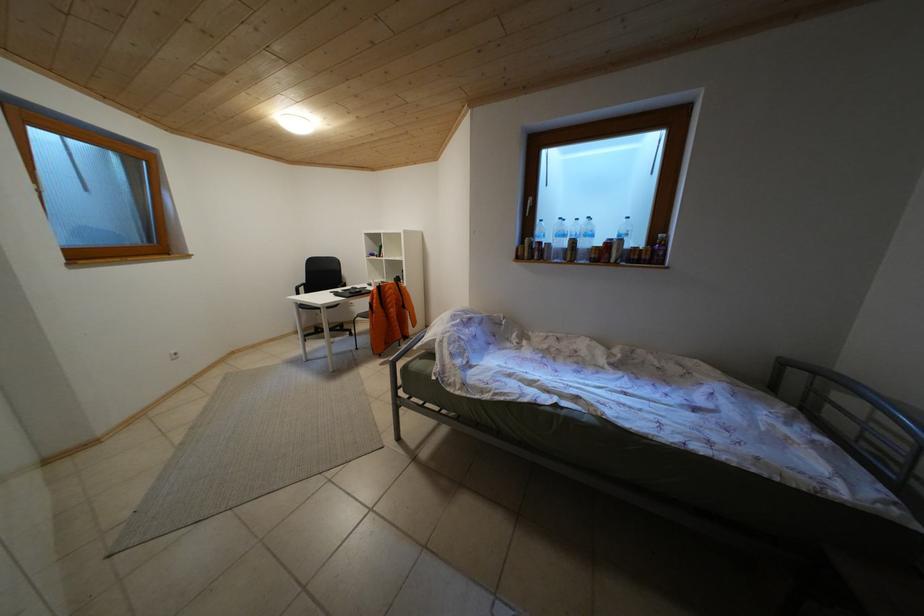
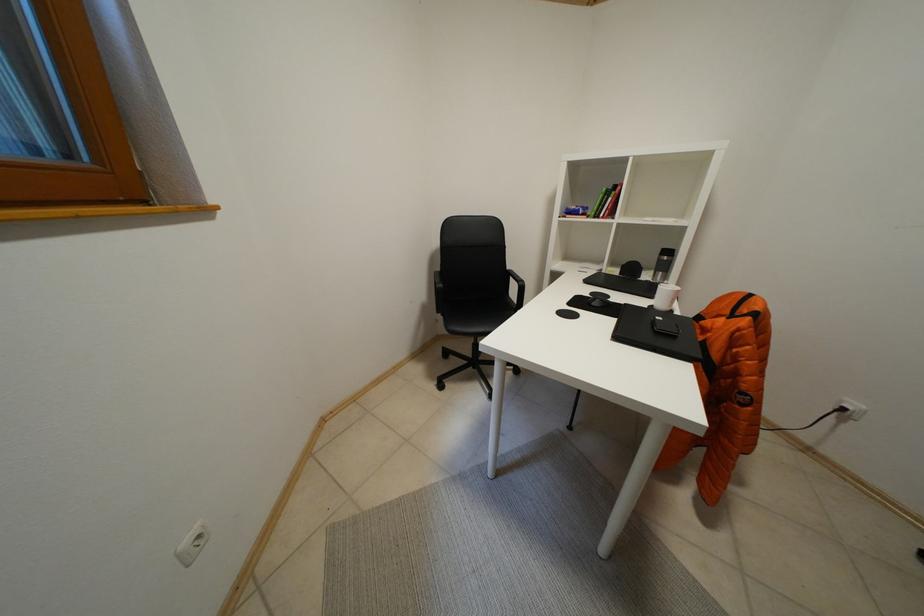
The images are taken continuously from a first-person perspective. In which direction are you moving?

The cameraman moved toward left, forward.